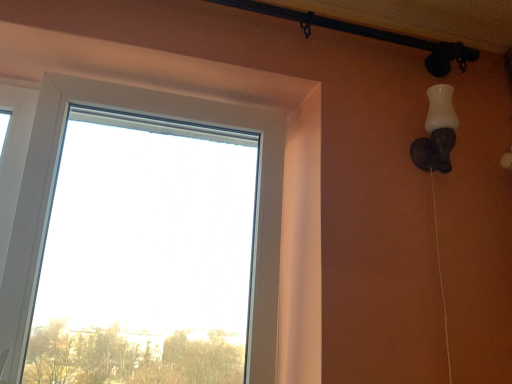
The image size is (512, 384). Identify the location of transparent glass window at center. (146, 113).

The image size is (512, 384). Describe the element at coordinates (146, 113) in the screenshot. I see `transparent glass window at center` at that location.

In order to face transparent glass window at center, should I rotate leftwards or rightwards?

To face it directly, rotate left by 13.860 degrees.

What do you see at coordinates (437, 132) in the screenshot?
I see `white matte lamp at upper right` at bounding box center [437, 132].

Identify the location of white matte lamp at upper right. The height and width of the screenshot is (384, 512). (437, 132).

Locate an element on the screen. transparent glass window at center is located at coordinates (146, 113).

Which object is positioned more to the right, transparent glass window at center or white matte lamp at upper right?

white matte lamp at upper right.

Considering the positions of objects transparent glass window at center and white matte lamp at upper right in the image provided, who is behind, transparent glass window at center or white matte lamp at upper right?

white matte lamp at upper right is more distant.

Which is farther, (268,233) or (436,127)?

Point (268,233)

From the image's perspective, which object appears higher, transparent glass window at center or white matte lamp at upper right?

From the image's view, white matte lamp at upper right is above.

From a real-world perspective, is transparent glass window at center on white matte lamp at upper right?

No, from a real-world perspective, transparent glass window at center is not above white matte lamp at upper right.

Is transparent glass window at center wider or thinner than white matte lamp at upper right?

transparent glass window at center is wider than white matte lamp at upper right.

Can you confirm if transparent glass window at center is taller than white matte lamp at upper right?

Yes.

Can you confirm if transparent glass window at center is smaller than white matte lamp at upper right?

Incorrect, transparent glass window at center is not smaller in size than white matte lamp at upper right.

Is transparent glass window at center inside or outside of white matte lamp at upper right?

transparent glass window at center is spatially situated outside white matte lamp at upper right.

Would you say transparent glass window at center is a long distance from white matte lamp at upper right?

They are positioned close to each other.

Is transparent glass window at center oriented towards white matte lamp at upper right?

No, transparent glass window at center does not turn towards white matte lamp at upper right.

Can you tell me how much transparent glass window at center and white matte lamp at upper right differ in facing direction?

The facing directions of transparent glass window at center and white matte lamp at upper right are 0.514 degrees apart.

Image resolution: width=512 pixels, height=384 pixels. What are the coordinates of `lamp lying behind the transparent glass window at center` in the screenshot? It's located at (437, 132).

Considering the relative positions of white matte lamp at upper right and transparent glass window at center in the image provided, is white matte lamp at upper right to the left of transparent glass window at center from the viewer's perspective?

Incorrect, white matte lamp at upper right is not on the left side of transparent glass window at center.

Which object is further away from the camera, white matte lamp at upper right or transparent glass window at center?

white matte lamp at upper right.

Does point (432, 115) lie in front of point (129, 92)?

That is True.

Consider the image. From the image's perspective, between white matte lamp at upper right and transparent glass window at center, who is located below?

transparent glass window at center, from the image's perspective.

From a real-world perspective, relative to transparent glass window at center, is white matte lamp at upper right vertically above or below?

white matte lamp at upper right is situated higher than transparent glass window at center in the real world.

Looking at their sizes, would you say white matte lamp at upper right is wider or thinner than transparent glass window at center?

In the image, white matte lamp at upper right appears to be more narrow than transparent glass window at center.

Which of these two, white matte lamp at upper right or transparent glass window at center, stands taller?

Standing taller between the two is transparent glass window at center.

Who is bigger, white matte lamp at upper right or transparent glass window at center?

Bigger between the two is transparent glass window at center.

Would you say white matte lamp at upper right is inside or outside transparent glass window at center?

white matte lamp at upper right is located beyond the bounds of transparent glass window at center.

Is there a large distance between white matte lamp at upper right and transparent glass window at center?

white matte lamp at upper right is actually quite close to transparent glass window at center.

Does white matte lamp at upper right turn towards transparent glass window at center?

No, white matte lamp at upper right does not turn towards transparent glass window at center.

You are a GUI agent. You are given a task and a screenshot of the screen. Output one action in this format:
    pyautogui.click(x=<x>, y=<y>)
    Task: Click on the lamp that appears above the transparent glass window at center (from a real-world perspective)
    
    Given the screenshot: What is the action you would take?
    pyautogui.click(x=437, y=132)

Locate an element on the screen. This screenshot has height=384, width=512. lamp that appears above the transparent glass window at center (from a real-world perspective) is located at coordinates (437, 132).

You are a GUI agent. You are given a task and a screenshot of the screen. Output one action in this format:
    pyautogui.click(x=<x>, y=<y>)
    Task: Click on the window below the white matte lamp at upper right (from a real-world perspective)
    The height and width of the screenshot is (384, 512).
    Given the screenshot: What is the action you would take?
    pyautogui.click(x=146, y=113)